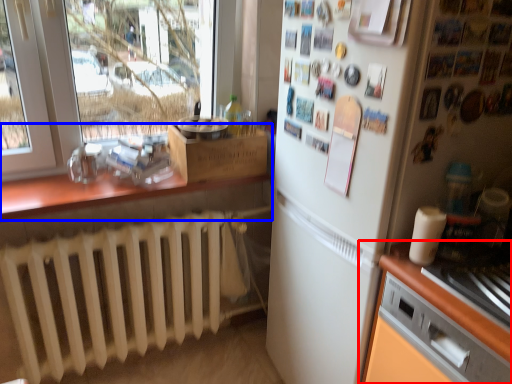
Question: Which object is closer to the camera taking this photo, cabinetry (highlighted by a red box) or countertop (highlighted by a blue box)?

Choices:
 (A) cabinetry
 (B) countertop

Answer: (A)